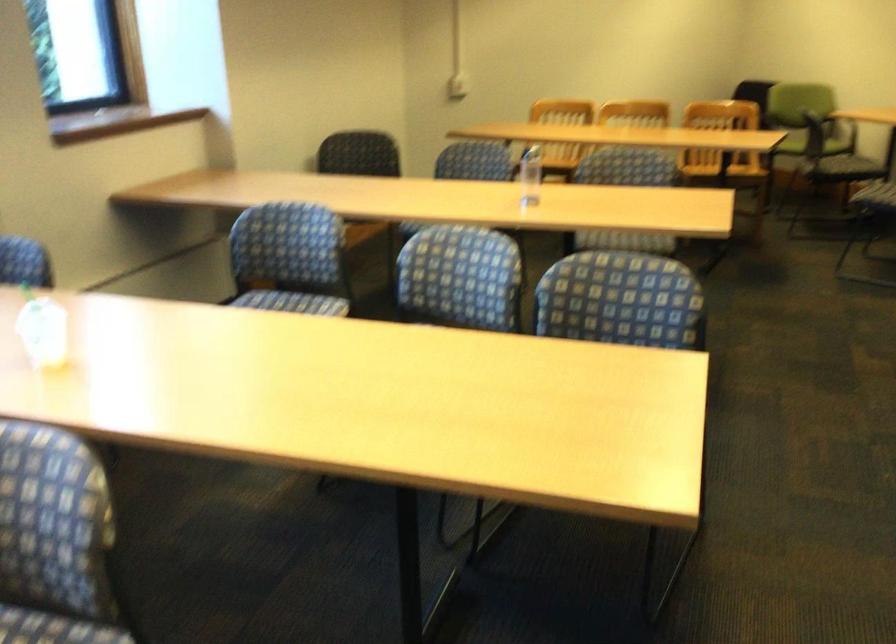
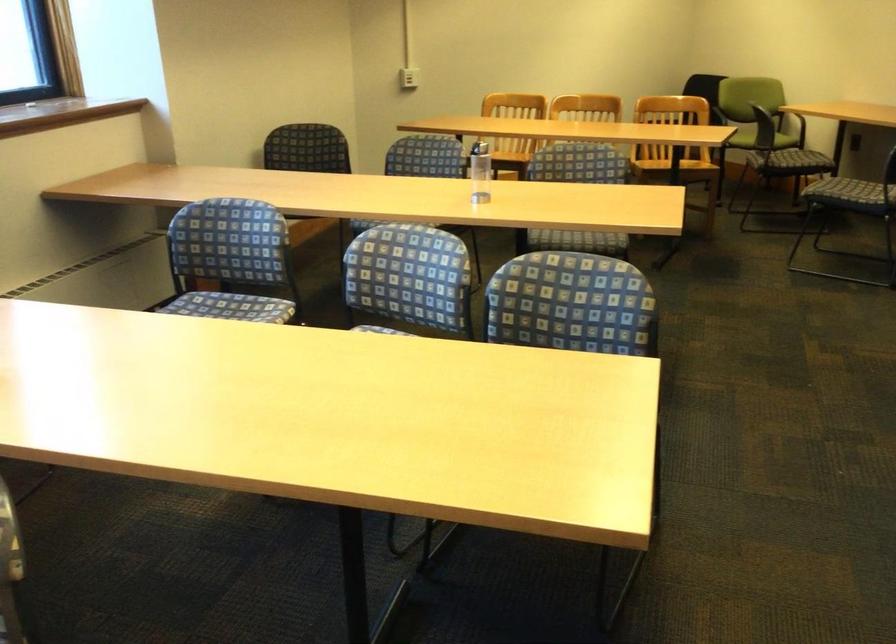
Question: The images are taken continuously from a first-person perspective. In which direction is your viewpoint rotating?

Choices:
 (A) Left
 (B) Right
 (C) Up
 (D) Down

Answer: (B)